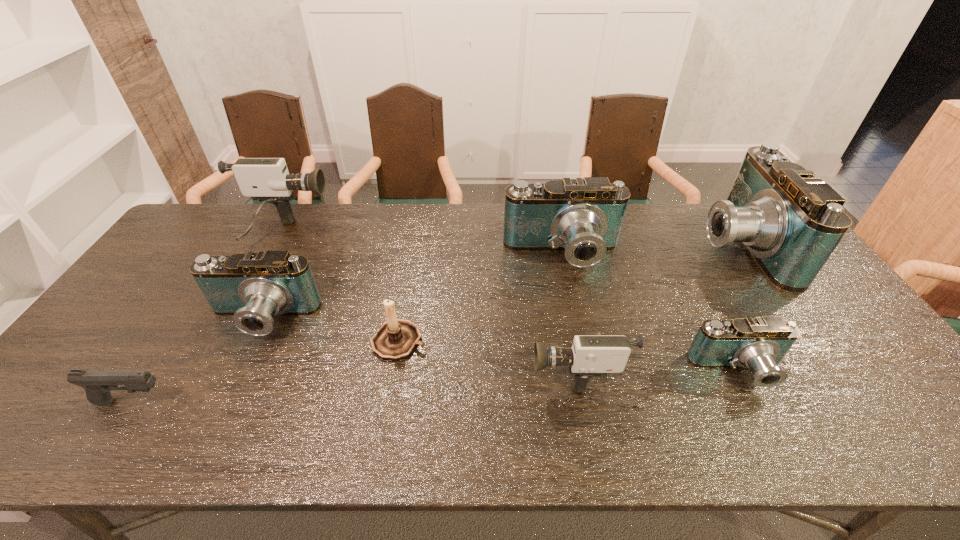
Identify the location of free point at the left edge. The image size is (960, 540). (130, 359).

Image resolution: width=960 pixels, height=540 pixels. Find the location of `vacant point at the right edge`. vacant point at the right edge is located at coordinates (852, 346).

This screenshot has width=960, height=540. Identify the location of empty space between the second nearest blue camcorder and the second blue camcorder from left to right. (412, 287).

Find the location of `empty location between the biggest blue camcorder and the second blue camcorder from left to right`. empty location between the biggest blue camcorder and the second blue camcorder from left to right is located at coordinates (650, 249).

Where is `unoccupied area between the biggest blue camcorder and the brown candle holder`? The image size is (960, 540). unoccupied area between the biggest blue camcorder and the brown candle holder is located at coordinates (568, 293).

Identify the location of vacant area that lies between the nearer white camcorder and the candle holder. pyautogui.click(x=487, y=355).

Where is `free point between the fourth object from left to right and the pistol`? free point between the fourth object from left to right and the pistol is located at coordinates (x=266, y=372).

Find the location of a particular element. The width and height of the screenshot is (960, 540). vacant area that lies between the second blue camcorder from left to right and the pistol is located at coordinates [x=348, y=328].

You are a GUI agent. You are given a task and a screenshot of the screen. Output one action in this format:
    pyautogui.click(x=<x>, y=<y>)
    Task: Click on the free space between the pistol and the second biggest blue camcorder
    
    Given the screenshot: What is the action you would take?
    pyautogui.click(x=348, y=328)

Find the location of a particular element. unoccupied area between the left white camcorder and the smallest blue camcorder is located at coordinates (511, 303).